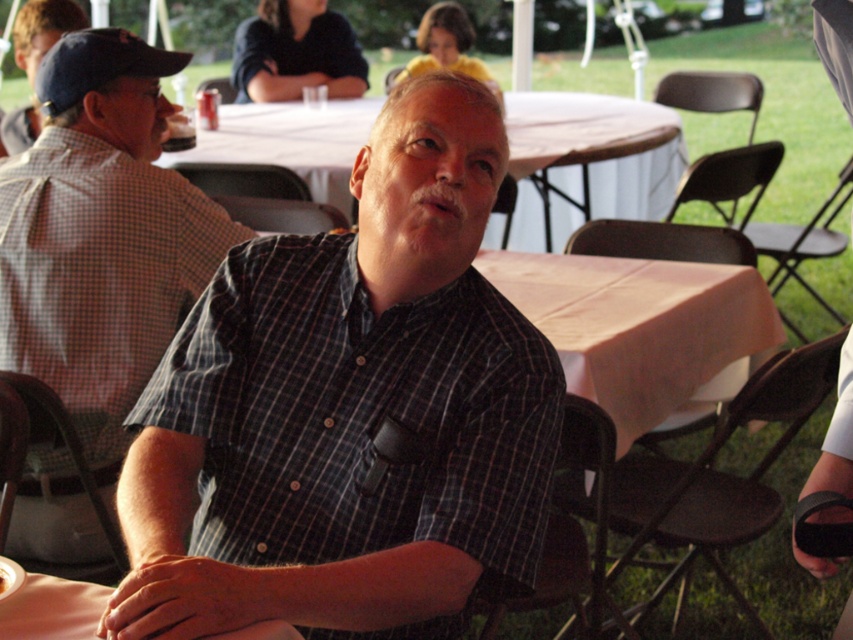
Question: Which object is farther from the camera taking this photo?

Choices:
 (A) plaid shirt at center
 (B) checkered fabric shirt at center

Answer: (B)

Question: Considering the relative positions of white cloth table at center and brown crumbly bread at center in the image provided, where is white cloth table at center located with respect to brown crumbly bread at center?

Choices:
 (A) left
 (B) right

Answer: (B)

Question: Considering the real-world distances, which object is farthest from the checkered fabric shirt at center?

Choices:
 (A) matte plaid shirt at left
 (B) white cloth table at center

Answer: (B)

Question: Is plaid shirt at center thinner than checkered fabric shirt at center?

Choices:
 (A) yes
 (B) no

Answer: (B)

Question: Does checkered fabric shirt at center appear on the left side of white cloth table at center?

Choices:
 (A) no
 (B) yes

Answer: (B)

Question: Which object is closer to the camera taking this photo?

Choices:
 (A) brown crumbly bread at center
 (B) white cloth table at center
 (C) plaid shirt at center

Answer: (C)